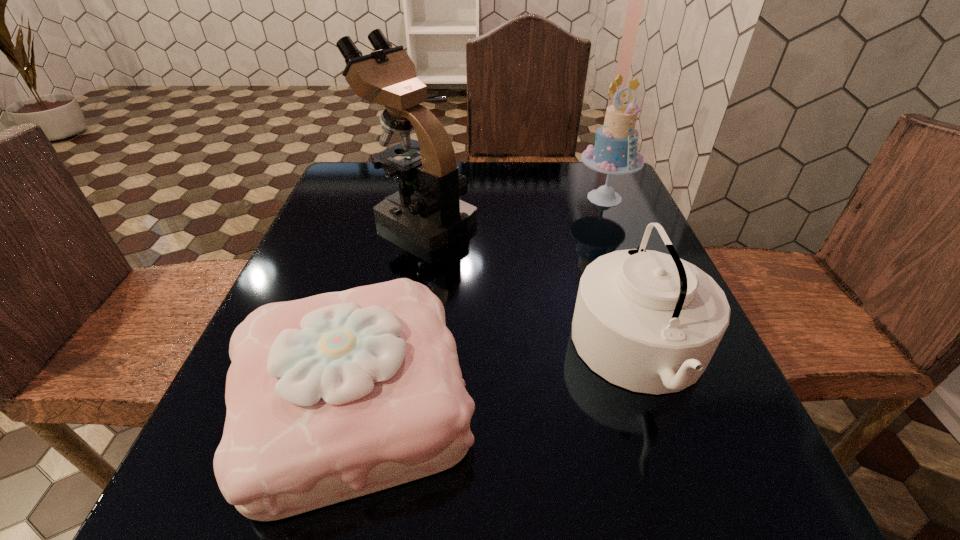
Where is `free point between the kettle and the shortest object`? free point between the kettle and the shortest object is located at coordinates (498, 377).

Where is `empty space between the third tallest object and the microscope`? The height and width of the screenshot is (540, 960). empty space between the third tallest object and the microscope is located at coordinates 531,286.

Where is `unoccupied position between the kettle and the microscope`? unoccupied position between the kettle and the microscope is located at coordinates (531, 286).

Where is `vacant area that lies between the microscope and the right cake`? Image resolution: width=960 pixels, height=540 pixels. vacant area that lies between the microscope and the right cake is located at coordinates (513, 208).

I want to click on vacant point located between the shorter cake and the second shortest object, so click(498, 377).

Identify the location of unoccupied area between the tallest object and the second tallest object. (513, 208).

Locate an element on the screen. The height and width of the screenshot is (540, 960). blank region between the shorter cake and the second shortest object is located at coordinates pos(498,377).

Image resolution: width=960 pixels, height=540 pixels. Identify the location of free space between the shorter cake and the kettle. (498, 377).

Find the location of a particular element. the second closest object to the third shortest object is located at coordinates (650, 322).

This screenshot has height=540, width=960. I want to click on the closest object to the shortest object, so click(x=650, y=322).